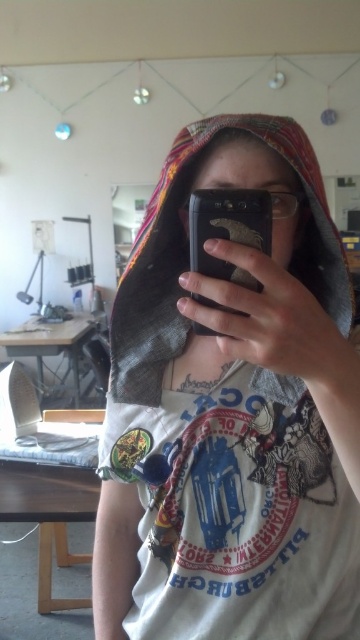
You are trying to decide whether to place the black matte smartphone at center on top of the denim jacket at center. Based on their sizes, will it fit without hanging over the edges?

The denim jacket at center is taller than the black matte smartphone at center, so placing the smartphone on top should work as it will not hang over the edges.

You are standing in the studio and want to place a small sticker on the closest point between point (308, 451) and point (205, 300). Which point should you choose?

Point (205, 300) is closer to you than point (308, 451), so you should choose point (205, 300) to place the sticker.

You are a photographer who needs to adjust the lighting for a photo shoot. You have a denim jacket at center and a black matte smartphone at center in your frame. Which object should you focus on to ensure proper exposure since it is closer to the camera?

The denim jacket at center is in front of the black matte smartphone at center, so you should focus on the denim jacket at center for proper exposure as it is closer to the camera.